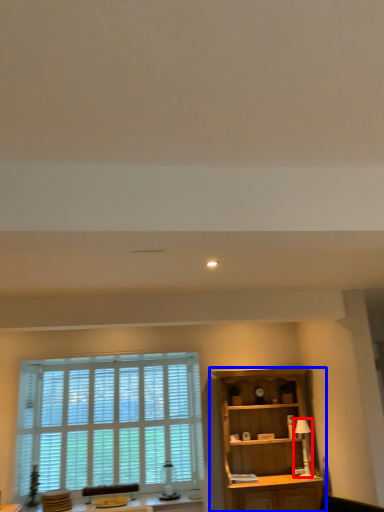
Question: Which of the following is the closest to the observer, lamp (highlighted by a red box) or cupboard (highlighted by a blue box)?

Choices:
 (A) lamp
 (B) cupboard

Answer: (B)